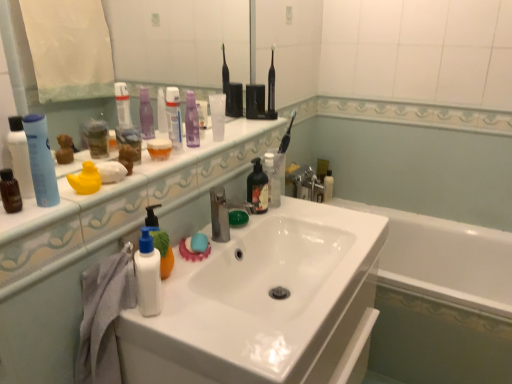
Question: Which direction should I rotate to face transparent plastic mouthwash at center, marked as the 3th mouthwash in a back-to-front arrangement, — up or down?

Choices:
 (A) down
 (B) up

Answer: (B)

Question: From a real-world perspective, does white glossy sink at center sit lower than rubber duck at left, which is counted as the 3th toiletry, starting from the back?

Choices:
 (A) no
 (B) yes

Answer: (B)

Question: Is the depth of white glossy sink at center greater than that of rubber duck at left, which is counted as the 2th toiletry, starting from the left?

Choices:
 (A) no
 (B) yes

Answer: (A)

Question: Is rubber duck at left, placed as the 3th toiletry when sorted from front to back, at the back of white glossy sink at center?

Choices:
 (A) yes
 (B) no

Answer: (B)

Question: Does white glossy sink at center appear on the right side of rubber duck at left, placed as the 4th toiletry when sorted from right to left?

Choices:
 (A) yes
 (B) no

Answer: (A)

Question: Considering the relative sizes of white glossy sink at center and rubber duck at left, which is counted as the 2th toiletry, starting from the left, in the image provided, is white glossy sink at center wider than rubber duck at left, which is counted as the 2th toiletry, starting from the left,?

Choices:
 (A) yes
 (B) no

Answer: (A)

Question: Is white glossy sink at center located outside rubber duck at left, placed as the 3th toiletry when sorted from front to back?

Choices:
 (A) yes
 (B) no

Answer: (A)

Question: From a real-world perspective, is translucent plastic bottle at center, acting as the 1th toiletry starting from the back, below blue matte shampoo bottle at left, acting as the 1th toiletry starting from the left?

Choices:
 (A) yes
 (B) no

Answer: (A)

Question: From the image's perspective, is translucent plastic bottle at center, which ranks as the fifth toiletry in left-to-right order, on top of blue matte shampoo bottle at left, acting as the 1th toiletry starting from the left?

Choices:
 (A) yes
 (B) no

Answer: (A)

Question: Does translucent plastic bottle at center, which ranks as the fifth toiletry in left-to-right order, lie in front of blue matte shampoo bottle at left, which is counted as the 5th toiletry, starting from the back?

Choices:
 (A) yes
 (B) no

Answer: (B)

Question: Considering the relative sizes of translucent plastic bottle at center, which ranks as the fifth toiletry in left-to-right order, and blue matte shampoo bottle at left, acting as the 1th toiletry starting from the left, in the image provided, is translucent plastic bottle at center, which ranks as the fifth toiletry in left-to-right order, shorter than blue matte shampoo bottle at left, acting as the 1th toiletry starting from the left,?

Choices:
 (A) yes
 (B) no

Answer: (B)

Question: Does translucent plastic bottle at center, which ranks as the fifth toiletry in left-to-right order, come behind blue matte shampoo bottle at left, arranged as the 1th toiletry when viewed from the front?

Choices:
 (A) yes
 (B) no

Answer: (A)

Question: Does translucent plastic bottle at center, acting as the 1th toiletry starting from the back, have a greater height compared to blue matte shampoo bottle at left, which is counted as the 5th toiletry, starting from the back?

Choices:
 (A) no
 (B) yes

Answer: (B)

Question: Is white matte lotion at center, the 3th toiletry from the right, wider than translucent plastic bottle at center, which is the fifth mouthwash from front to back?

Choices:
 (A) yes
 (B) no

Answer: (B)